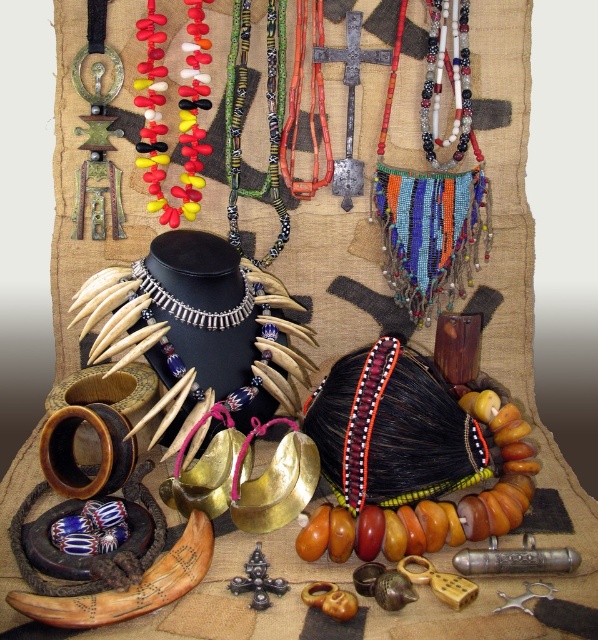
You are a jewelry designer who wants to place the beaded fabric necklace at center and the silver metallic necklace at center on a display stand. The stand has two hooks separated by 15 inches. Will both necklaces fit on the stand without overlapping?

The beaded fabric necklace at center is 14.69 inches from the silver metallic necklace at center. Since the distance between the hooks is 15 inches, which is slightly larger than the required space, both necklaces can fit on the stand without overlapping.

You are a customer at a jewelry store and see the rubber beads necklace at center and the multicolored beaded necklace at center displayed on a mannequin. Which necklace would reach lower on the customer when worn?

The multicolored beaded necklace at center reaches lower on the customer when worn because it is longer than the rubber beads necklace at center.